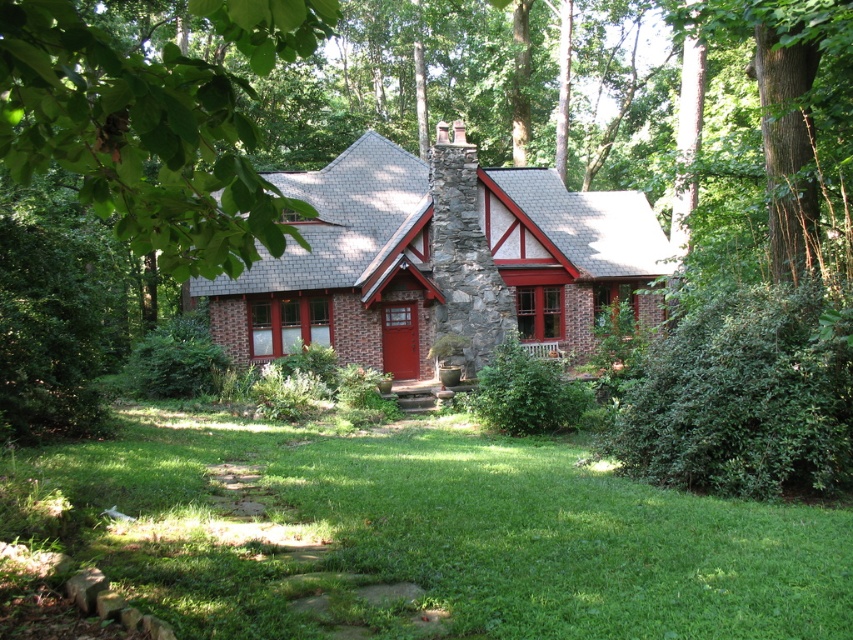
Question: Which of the following is the farthest from the observer?

Choices:
 (A) green leafy tree at upper left
 (B) green grass at center

Answer: (B)

Question: Considering the relative positions of brick house at center and green leafy tree at upper left in the image provided, where is brick house at center located with respect to green leafy tree at upper left?

Choices:
 (A) right
 (B) left

Answer: (A)

Question: Can you confirm if green grass at center is positioned below green leafy tree at upper left?

Choices:
 (A) no
 (B) yes

Answer: (B)

Question: Based on their relative distances, which object is farther from the green leafy tree at upper left?

Choices:
 (A) brick house at center
 (B) green grass at center

Answer: (A)

Question: Is green grass at center wider than brick house at center?

Choices:
 (A) yes
 (B) no

Answer: (B)

Question: Which point is farther to the camera?

Choices:
 (A) (399, 477)
 (B) (421, 344)
 (C) (195, 260)

Answer: (B)